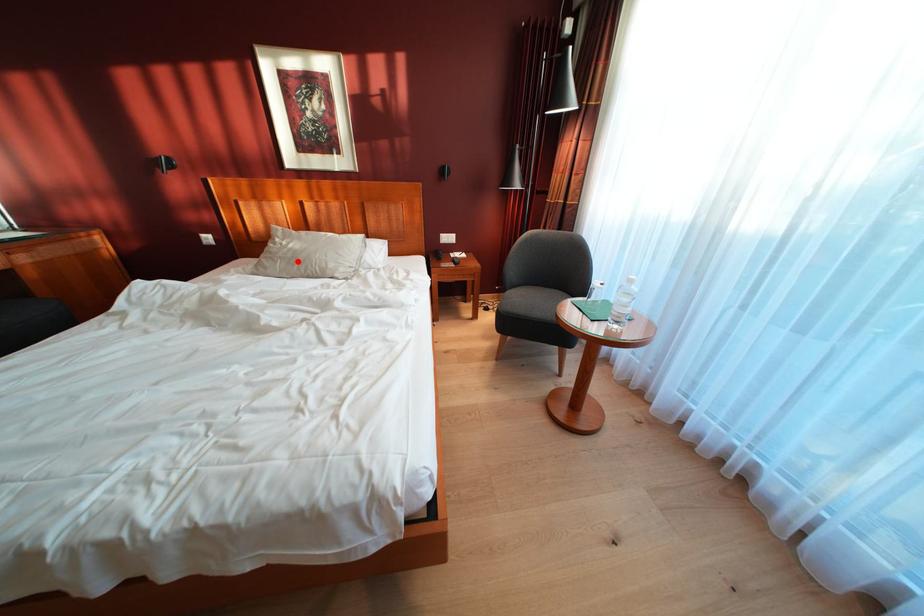
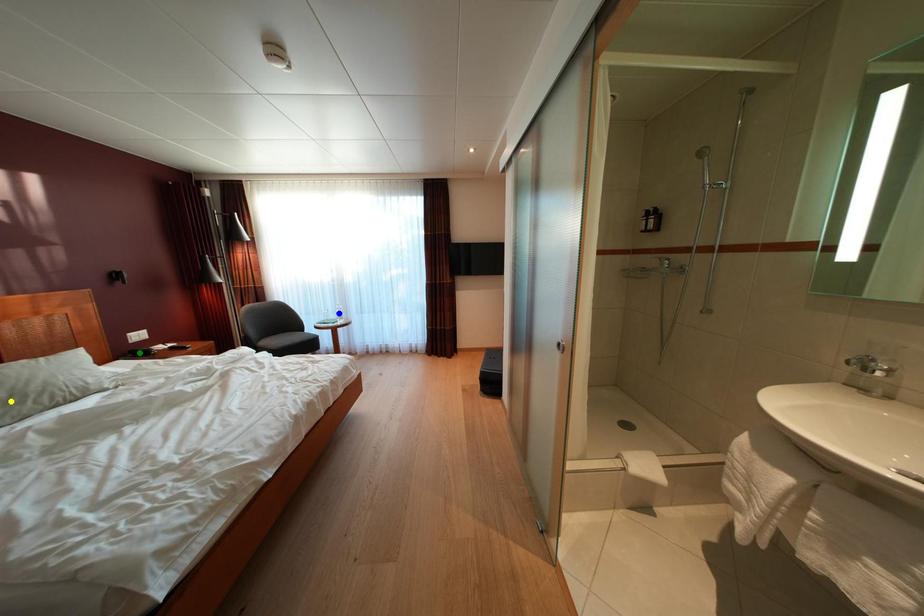
Question: I am providing you with two images of the same scene from different viewpoints. A red point is marked on the first image. You are given multiple points on the second image. In image 2, which mark is for the same physical point as the one in image 1?

Choices:
 (A) green point
 (B) blue point
 (C) yellow point

Answer: (C)